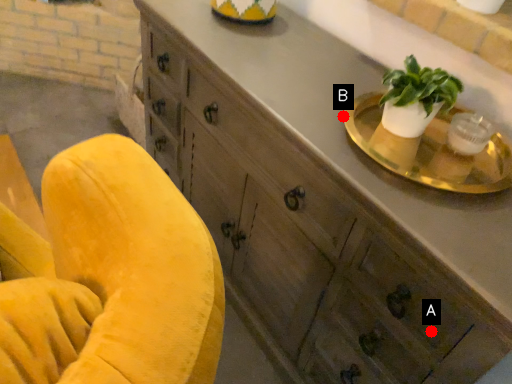
Question: Two points are circled on the image, labeled by A and B beside each circle. Which point is closer to the camera?

Choices:
 (A) A is closer
 (B) B is closer

Answer: (A)